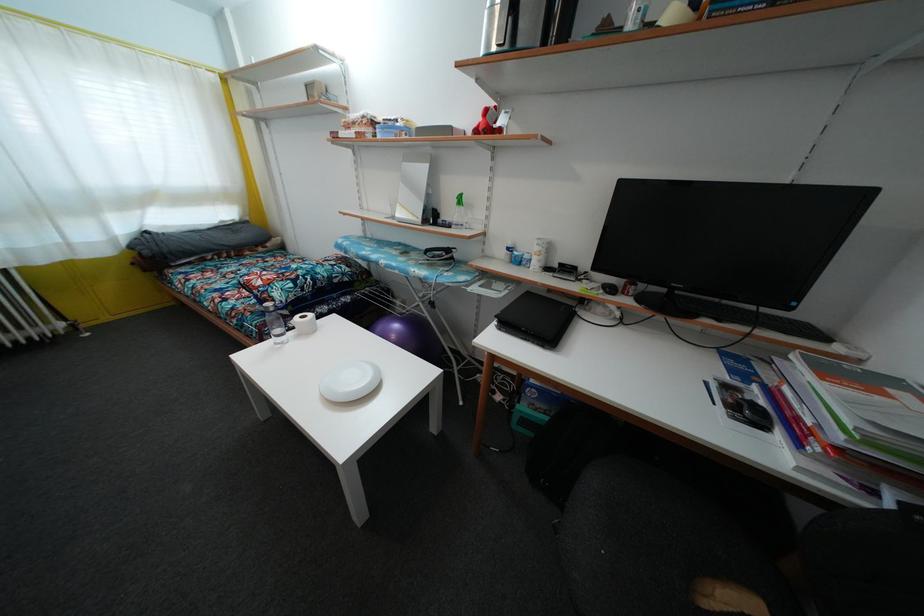
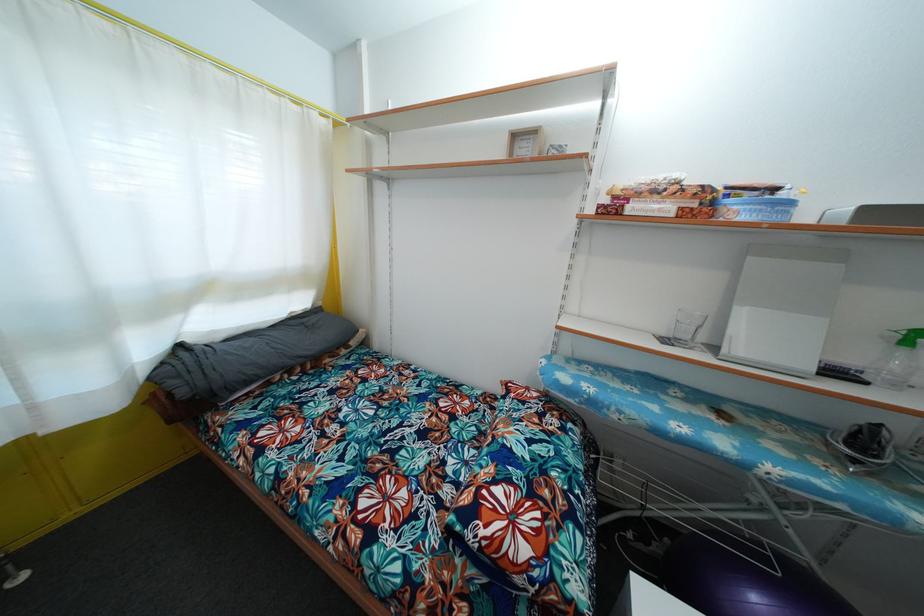
Find the pixel in the second image that matches (x=368, y=123) in the first image.

(683, 188)